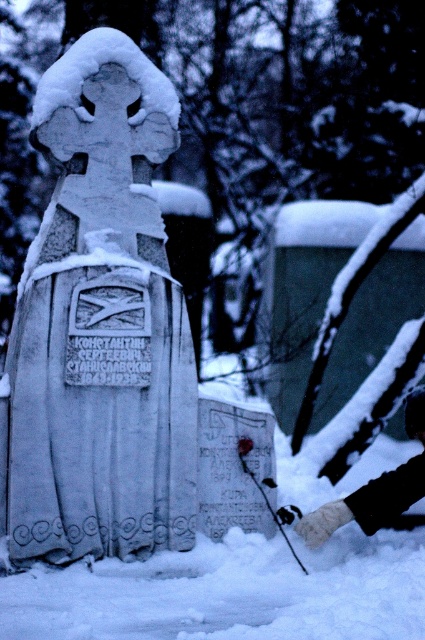
You are an archaeologist examining a winter grave site. You notice the white stone cross at center and the fuzzy woolen glove at lower right. Based on their positions, which object is located more to the left?

The white stone cross at center is positioned on the left side of fuzzy woolen glove at lower right, so it is more to the left.

You are standing in a snowy graveyard and see the white stone cross at center and the fuzzy woolen glove at lower right. Which object is nearer to you?

The white stone cross at center is closer to the viewer than the fuzzy woolen glove at lower right.

You are an archaeologist examining the winter scene. You need to determine which object is larger between the white stone cross at center and the fuzzy woolen glove at lower right. Based on the scene, which one is bigger?

The white stone cross at center is bigger than the fuzzy woolen glove at lower right.